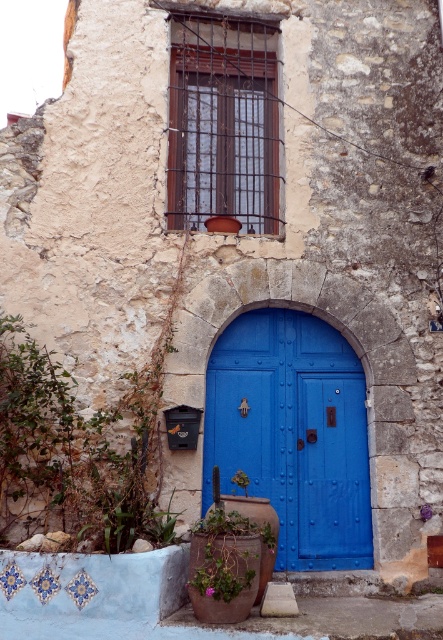
Question: Can you confirm if blue painted wood door at center is smaller than wooden window at upper center?

Choices:
 (A) yes
 (B) no

Answer: (B)

Question: Is blue painted wood door at center closer to the viewer compared to green leafy plant at lower center?

Choices:
 (A) no
 (B) yes

Answer: (A)

Question: Which object appears closest to the camera in this image?

Choices:
 (A) green leafy plant at center
 (B) blue painted wood door at center
 (C) green leafy plant at lower center

Answer: (C)

Question: Does blue painted wood door at center have a larger size compared to wooden window at upper center?

Choices:
 (A) no
 (B) yes

Answer: (B)

Question: Considering the real-world distances, which object is closest to the green leafy plant at lower center?

Choices:
 (A) green leafy plant at lower left
 (B) blue painted wood door at center

Answer: (A)

Question: Which of the following is the closest to the observer?

Choices:
 (A) (155, 392)
 (B) (226, 381)
 (C) (267, 529)

Answer: (C)